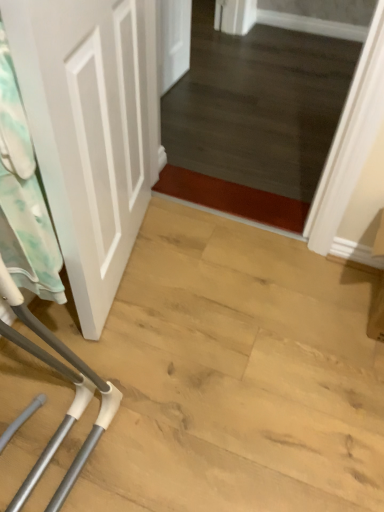
This screenshot has width=384, height=512. Identify the location of vacant space underneath white matte door at left (from a real-world perspective). (99, 329).